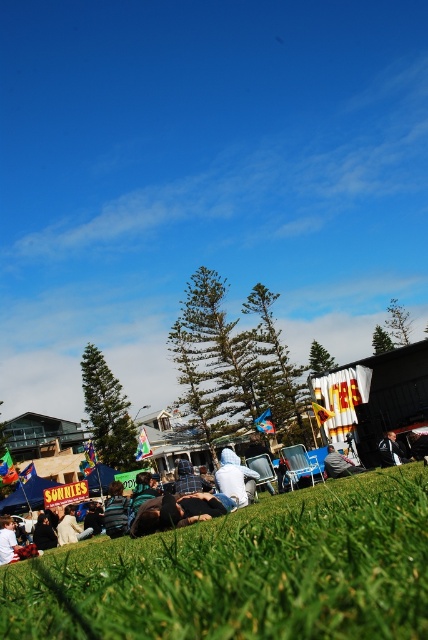
Consider the image. Is white fabric at center positioned at the back of black leather jacket at center?

No, it is in front of black leather jacket at center.

Where is `white fabric at center`? The image size is (428, 640). white fabric at center is located at coordinates (235, 477).

Who is more forward, (329, 460) or (386, 436)?

Point (329, 460) is more forward.

Who is lower down, white fabric umbrella at center or black leather jacket at center?

white fabric umbrella at center is lower down.

The width and height of the screenshot is (428, 640). I want to click on white fabric umbrella at center, so click(338, 465).

The image size is (428, 640). In order to click on white fabric umbrella at center in this screenshot , I will do `click(338, 465)`.

Can you confirm if white fabric at center is smaller than white fabric umbrella at center?

Actually, white fabric at center might be larger than white fabric umbrella at center.

Does white fabric at center have a greater height compared to white fabric umbrella at center?

Yes.

Is point (225, 483) positioned before point (335, 458)?

Yes, it is in front of point (335, 458).

The width and height of the screenshot is (428, 640). In order to click on white fabric at center in this screenshot , I will do `click(235, 477)`.